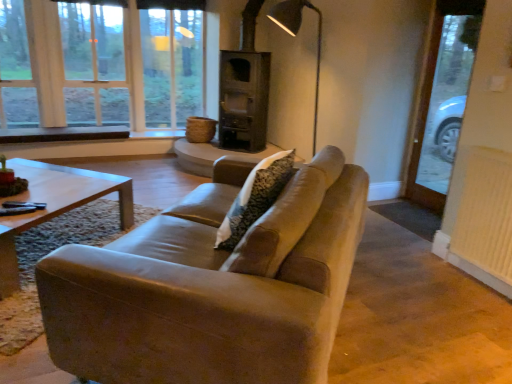
Measure the distance between leather couch at center and camera.

leather couch at center and camera are 1.19 meters apart from each other.

What do you see at coordinates (485, 220) in the screenshot? I see `white textured radiator at right` at bounding box center [485, 220].

Identify the location of clear glass window at upper left. The image size is (512, 384). (101, 67).

What do you see at coordinates (295, 36) in the screenshot? This screenshot has width=512, height=384. I see `metallic gray floor lamp at upper center` at bounding box center [295, 36].

Locate an element on the screen. This screenshot has height=384, width=512. leather couch at center is located at coordinates (212, 286).

From the picture: Which object is positioned more to the right, leather couch at center or clear glass door at right?

clear glass door at right is more to the right.

Can you tell me how much leather couch at center and clear glass door at right differ in facing direction?

41.6 degrees.

Is leather couch at center outside of clear glass door at right?

Absolutely, leather couch at center is external to clear glass door at right.

How far apart are leather couch at center and clear glass door at right?

leather couch at center is 7.70 feet from clear glass door at right.

Who is more distant, clear glass window at upper left or metallic gray floor lamp at upper center?

Positioned behind is clear glass window at upper left.

Which object is positioned more to the left, clear glass window at upper left or metallic gray floor lamp at upper center?

clear glass window at upper left.

Measure the distance from clear glass window at upper left to metallic gray floor lamp at upper center.

clear glass window at upper left is 2.21 meters away from metallic gray floor lamp at upper center.

Would you say clear glass window at upper left is outside metallic gray floor lamp at upper center?

That's correct, clear glass window at upper left is outside of metallic gray floor lamp at upper center.

Is white textured radiator at right inside the boundaries of clear glass door at right, or outside?

white textured radiator at right is located beyond the bounds of clear glass door at right.

Considering the relative sizes of white textured radiator at right and clear glass door at right in the image provided, is white textured radiator at right smaller than clear glass door at right?

Indeed, white textured radiator at right has a smaller size compared to clear glass door at right.

Which is behind, white textured radiator at right or clear glass door at right?

clear glass door at right is further away from the camera.

Considering the sizes of objects white textured radiator at right and clear glass door at right in the image provided, who is thinner, white textured radiator at right or clear glass door at right?

Thinner between the two is clear glass door at right.

From the image's perspective, is leather couch at center located beneath metallic gray floor lamp at upper center?

Indeed, from the image's perspective, leather couch at center is shown beneath metallic gray floor lamp at upper center.

Considering the sizes of objects leather couch at center and metallic gray floor lamp at upper center in the image provided, who is bigger, leather couch at center or metallic gray floor lamp at upper center?

Bigger between the two is leather couch at center.

Identify the location of lamp above the leather couch at center (from a real-world perspective). (295, 36).

Does leather couch at center turn towards metallic gray floor lamp at upper center?

No, leather couch at center does not turn towards metallic gray floor lamp at upper center.

Which object is positioned more to the right, metallic gray floor lamp at upper center or clear glass window at upper left?

metallic gray floor lamp at upper center.

Between metallic gray floor lamp at upper center and clear glass window at upper left, which one has more height?

With more height is clear glass window at upper left.

Considering the relative sizes of metallic gray floor lamp at upper center and clear glass window at upper left in the image provided, is metallic gray floor lamp at upper center thinner than clear glass window at upper left?

In fact, metallic gray floor lamp at upper center might be wider than clear glass window at upper left.

Is point (283, 28) positioned in front of point (463, 258)?

No, (283, 28) is further to viewer.

Image resolution: width=512 pixels, height=384 pixels. What are the coordinates of `radiator below the metallic gray floor lamp at upper center (from a real-world perspective)` in the screenshot? It's located at (485, 220).

Does metallic gray floor lamp at upper center have a greater width compared to white textured radiator at right?

Yes.

Is metallic gray floor lamp at upper center beside white textured radiator at right?

No, metallic gray floor lamp at upper center is not touching white textured radiator at right.

Is metallic gray floor lamp at upper center oriented towards leather couch at center?

No, metallic gray floor lamp at upper center is not aimed at leather couch at center.

Does point (312, 140) come in front of point (240, 266)?

No, (312, 140) is further to viewer.

Between metallic gray floor lamp at upper center and leather couch at center, which one appears on the left side from the viewer's perspective?

leather couch at center is more to the left.

Can you confirm if metallic gray floor lamp at upper center is wider than leather couch at center?

Incorrect, the width of metallic gray floor lamp at upper center does not surpass that of leather couch at center.

The image size is (512, 384). I want to click on screen door behind the leather couch at center, so (x=443, y=100).

What are the coordinates of `lamp in front of the clear glass window at upper left` in the screenshot? It's located at (295, 36).

Which object lies further to the anchor point metallic gray floor lamp at upper center, leather couch at center or white textured radiator at right?

Based on the image, leather couch at center appears to be further to metallic gray floor lamp at upper center.

When comparing their distances from white textured radiator at right, does leather couch at center or metallic gray floor lamp at upper center seem further?

metallic gray floor lamp at upper center.

Which object lies nearer to the anchor point white textured radiator at right, clear glass window at upper left or leather couch at center?

Based on the image, leather couch at center appears to be nearer to white textured radiator at right.

Estimate the real-world distances between objects in this image. Which object is further from white textured radiator at right, clear glass window at upper left or clear glass door at right?

clear glass window at upper left is further to white textured radiator at right.

Which object lies nearer to the anchor point leather couch at center, clear glass window at upper left or white textured radiator at right?

white textured radiator at right is positioned closer to the anchor leather couch at center.

Estimate the real-world distances between objects in this image. Which object is further from white textured radiator at right, metallic gray floor lamp at upper center or leather couch at center?

metallic gray floor lamp at upper center.

Estimate the real-world distances between objects in this image. Which object is further from white textured radiator at right, metallic gray floor lamp at upper center or clear glass door at right?

metallic gray floor lamp at upper center is further to white textured radiator at right.

Based on the photo, from the image, which object appears to be nearer to clear glass door at right, leather couch at center or metallic gray floor lamp at upper center?

metallic gray floor lamp at upper center lies closer to clear glass door at right than the other object.

At what (x,y) coordinates should I click in order to perform the action: click on radiator situated between metallic gray floor lamp at upper center and clear glass door at right from left to right. Please return your answer as a coordinate pair (x, y). Looking at the image, I should click on (485, 220).

Where is `screen door between leather couch at center and metallic gray floor lamp at upper center in the front-back direction`? The image size is (512, 384). screen door between leather couch at center and metallic gray floor lamp at upper center in the front-back direction is located at coordinates 443,100.

At what (x,y) coordinates should I click in order to perform the action: click on lamp between clear glass window at upper left and white textured radiator at right in the horizontal direction. Please return your answer as a coordinate pair (x, y). Looking at the image, I should click on (295, 36).

Find the location of a particular element. The height and width of the screenshot is (384, 512). radiator positioned between leather couch at center and clear glass door at right from near to far is located at coordinates (485, 220).